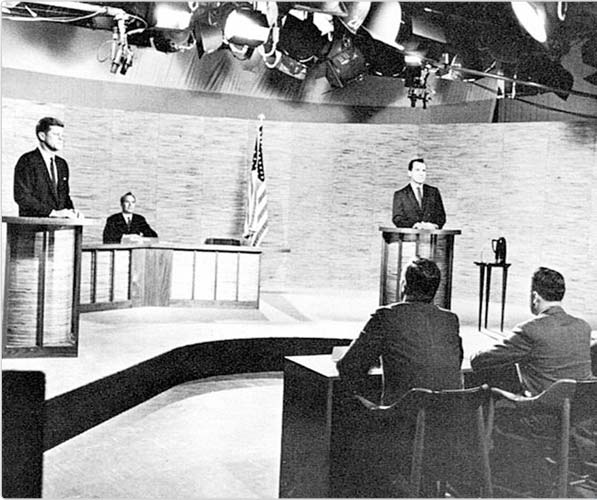
This screenshot has height=500, width=597. I want to click on table, so click(488, 264).